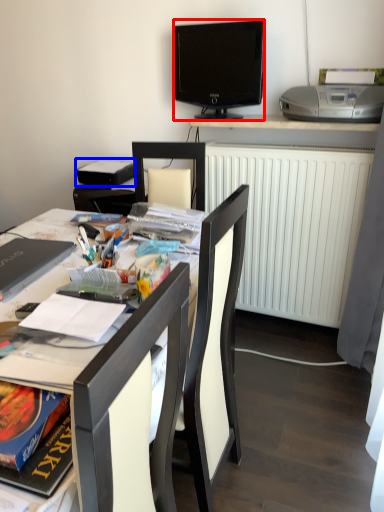
Question: Which of the following is the farthest to the observer, television (highlighted by a red box) or book (highlighted by a blue box)?

Choices:
 (A) television
 (B) book

Answer: (B)